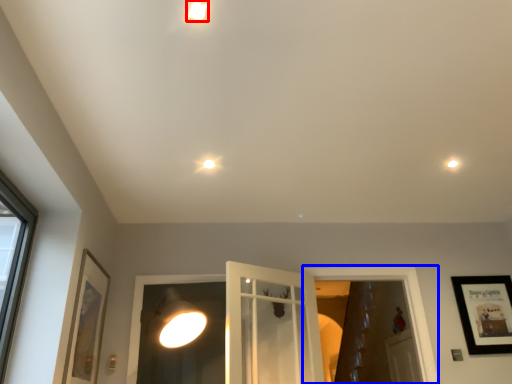
Question: Among these objects, which one is farthest to the camera, droplight (highlighted by a red box) or window frame (highlighted by a blue box)?

Choices:
 (A) droplight
 (B) window frame

Answer: (B)